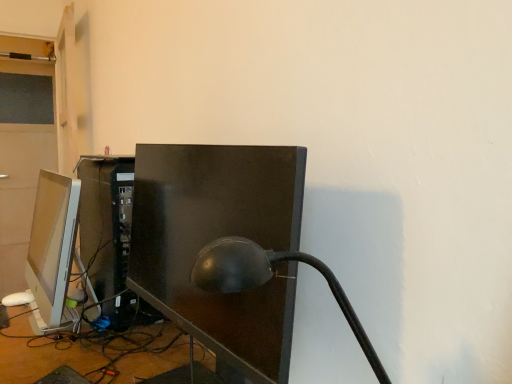
Question: Relative to matte white monitor at left, the 1th computer monitor in the left-to-right sequence, is matte black lamp at center in front or behind?

Choices:
 (A) behind
 (B) front

Answer: (B)

Question: Which is correct: matte black lamp at center is inside matte white monitor at left, the 1th computer monitor in the left-to-right sequence, or outside of it?

Choices:
 (A) inside
 (B) outside

Answer: (B)

Question: Which is nearer to the matte white monitor at left, positioned as the second computer monitor in right-to-left order?

Choices:
 (A) matte black lamp at center
 (B) matte black monitor at center, placed as the second computer monitor when sorted from left to right

Answer: (B)

Question: Which is farther from the matte black monitor at center, placed as the 1th computer monitor when sorted from right to left?

Choices:
 (A) matte white monitor at left, the 1th computer monitor in the left-to-right sequence
 (B) matte black lamp at center

Answer: (A)